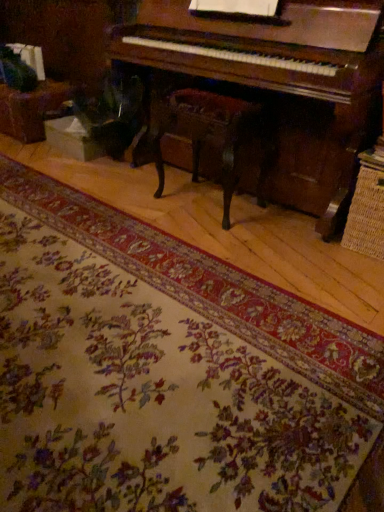
Locate an element on the screen. Image resolution: width=384 pixels, height=512 pixels. vacant region above floral carpet at center (from a real-world perspective) is located at coordinates (110, 296).